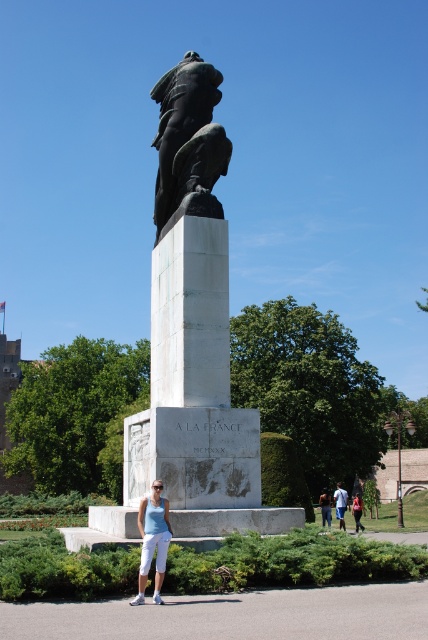
You are an artist looking to paint the statue. You notice the matte white pants at center and the blue denim jeans at lower center. Which piece of clothing is covering the other?

The matte white pants at center is positioned over blue denim jeans at lower center, so the matte white pants at center is covering the blue denim jeans at lower center.

You are an art student analyzing the statue. You notice the black bronze eagle at upper center and the matte white pants at center. Which object is positioned higher in the image?

The black bronze eagle at upper center is positioned higher than the matte white pants at center.

You are an art conservator assessing the statue. You notice the black bronze eagle at upper center and the matte white pants at center. Which object might require more space for restoration work due to its size?

The black bronze eagle at upper center might require more space for restoration work because it is wider than the matte white pants at center.